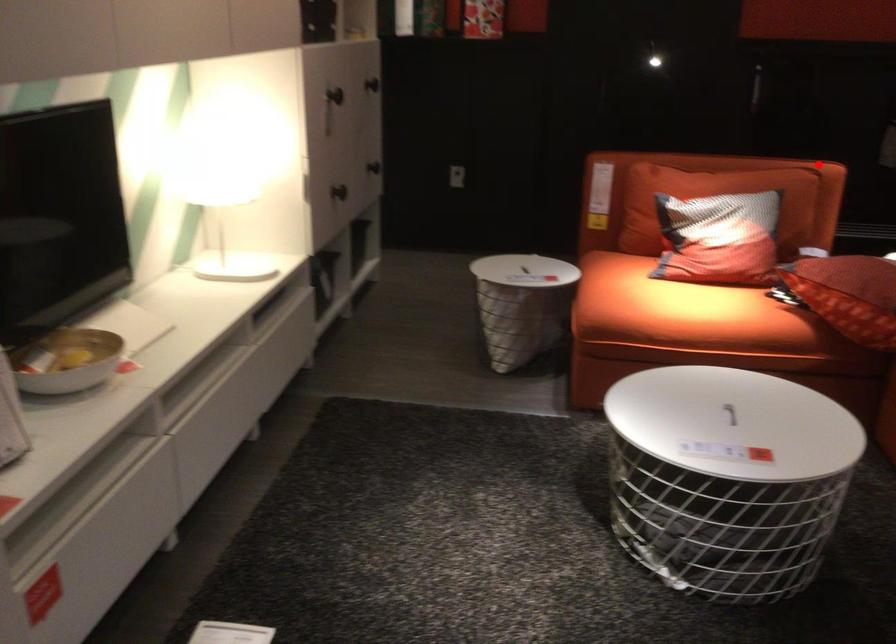
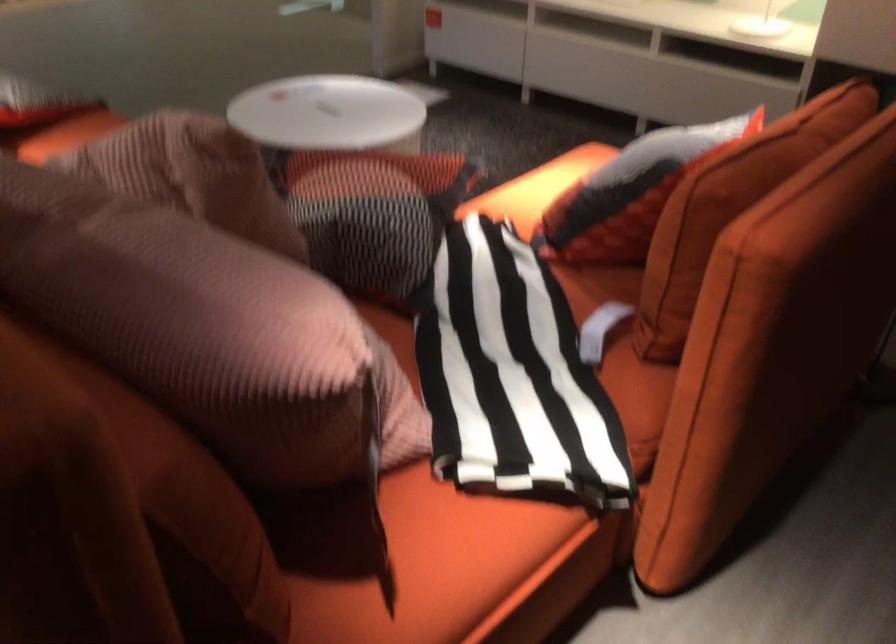
Question: I am providing you with two images of the same scene from different viewpoints. In image1, a red point is highlighted. Considering the same 3D point in image2, which of the following is correct?

Choices:
 (A) It is closer
 (B) It is farther

Answer: (A)